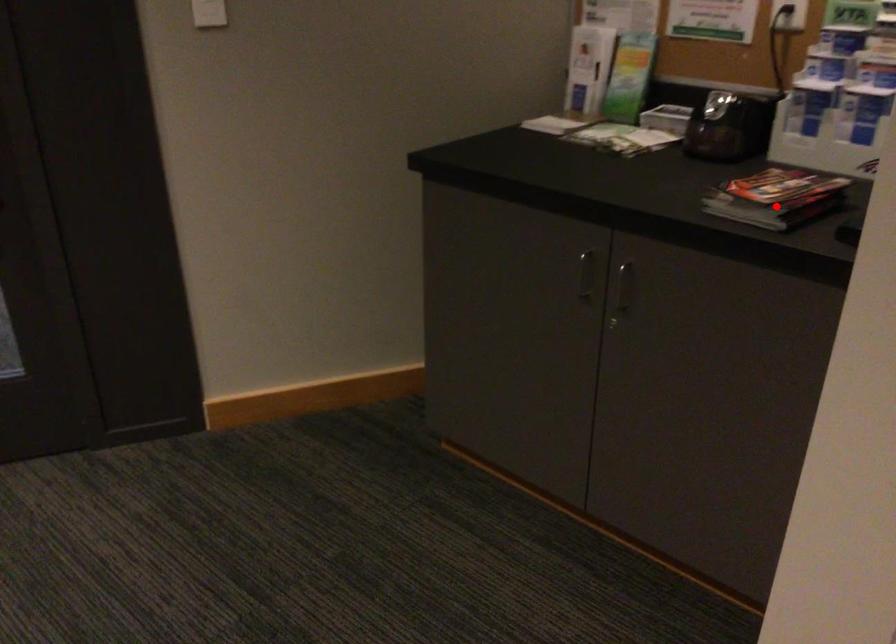
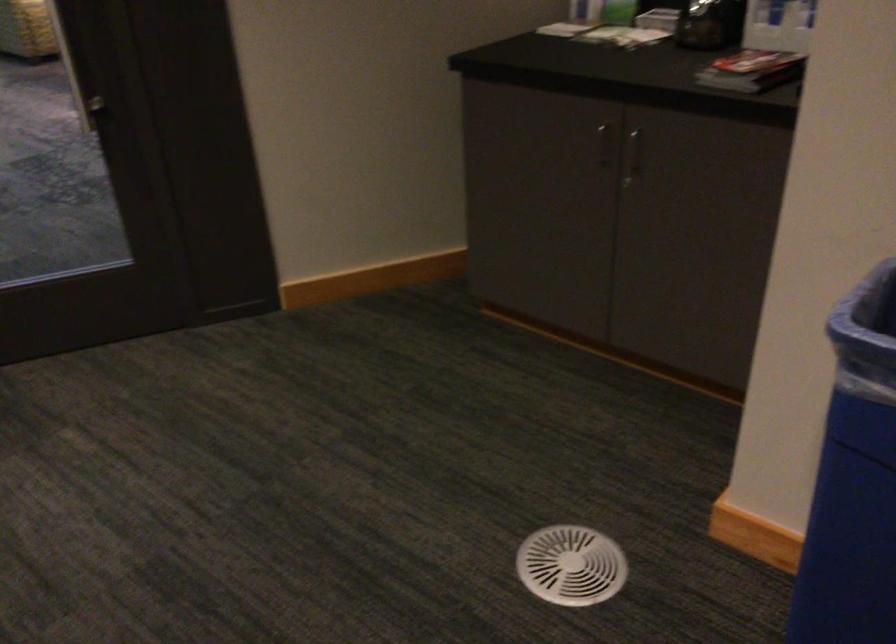
Where in the second image is the point corresponding to the highlighted location from the first image?

(751, 71)